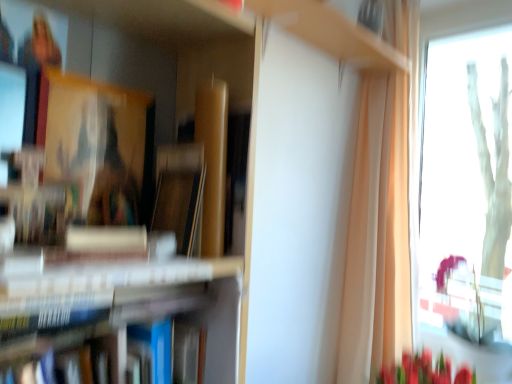
Question: Should I look upward or downward to see wooden cabinet at upper center?

Choices:
 (A) up
 (B) down

Answer: (A)

Question: Does wooden cabinet at upper center appear on the right side of transparent glass window at right?

Choices:
 (A) no
 (B) yes

Answer: (A)

Question: Is wooden cabinet at upper center thinner than transparent glass window at right?

Choices:
 (A) no
 (B) yes

Answer: (A)

Question: Is the position of wooden cabinet at upper center more distant than that of transparent glass window at right?

Choices:
 (A) yes
 (B) no

Answer: (B)

Question: Does wooden cabinet at upper center turn towards transparent glass window at right?

Choices:
 (A) no
 (B) yes

Answer: (A)

Question: Is wooden cabinet at upper center positioned beyond the bounds of transparent glass window at right?

Choices:
 (A) no
 (B) yes

Answer: (B)

Question: Considering the relative sizes of wooden cabinet at upper center and transparent glass window at right in the image provided, is wooden cabinet at upper center bigger than transparent glass window at right?

Choices:
 (A) no
 (B) yes

Answer: (A)

Question: From a real-world perspective, is hardcover books at left under wooden cabinet at upper center?

Choices:
 (A) yes
 (B) no

Answer: (A)

Question: From the image's perspective, does hardcover books at left appear lower than wooden cabinet at upper center?

Choices:
 (A) yes
 (B) no

Answer: (A)

Question: Does hardcover books at left have a lesser width compared to wooden cabinet at upper center?

Choices:
 (A) no
 (B) yes

Answer: (A)

Question: Can you confirm if hardcover books at left is positioned to the left of wooden cabinet at upper center?

Choices:
 (A) yes
 (B) no

Answer: (A)

Question: Can you confirm if hardcover books at left is taller than wooden cabinet at upper center?

Choices:
 (A) no
 (B) yes

Answer: (B)

Question: Considering the relative positions of hardcover books at left and wooden cabinet at upper center in the image provided, is hardcover books at left in front of wooden cabinet at upper center?

Choices:
 (A) yes
 (B) no

Answer: (A)

Question: Can you confirm if transparent glass window at right is bigger than hardcover books at left?

Choices:
 (A) no
 (B) yes

Answer: (B)